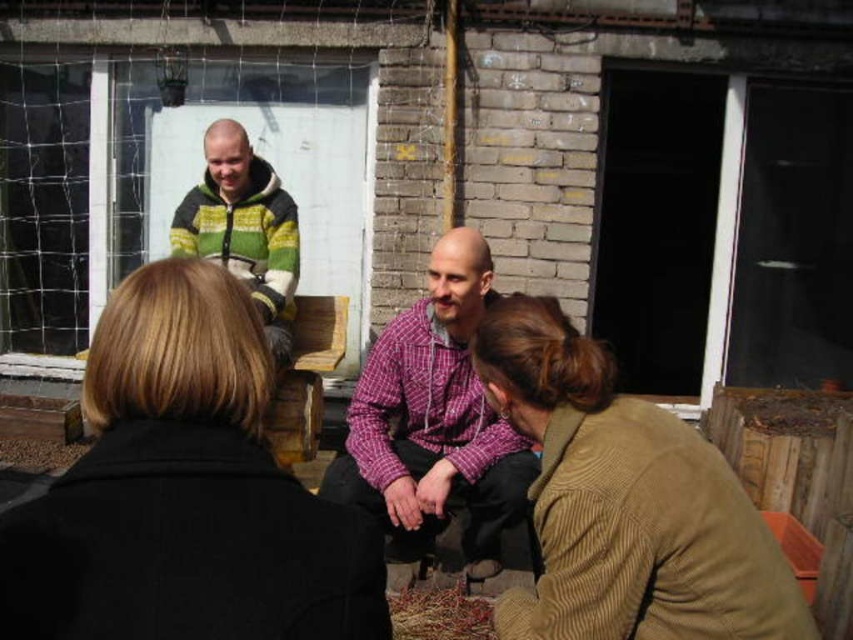
Question: Considering the relative positions of black wool coat at center and knitted wool sweater at upper left in the image provided, where is black wool coat at center located with respect to knitted wool sweater at upper left?

Choices:
 (A) above
 (B) below

Answer: (B)

Question: Is brown corduroy jacket at lower right to the right of knitted wool sweater at upper left from the viewer's perspective?

Choices:
 (A) yes
 (B) no

Answer: (A)

Question: Estimate the real-world distances between objects in this image. Which object is closer to the brown corduroy jacket at lower right?

Choices:
 (A) black wool coat at center
 (B) knitted wool sweater at upper left

Answer: (A)

Question: Is black wool coat at center further to camera compared to brown corduroy jacket at lower right?

Choices:
 (A) no
 (B) yes

Answer: (A)

Question: Which object appears closest to the camera in this image?

Choices:
 (A) black wool coat at center
 (B) knitted wool sweater at upper left
 (C) brown corduroy jacket at lower right
 (D) purple checkered shirt at center

Answer: (A)

Question: Among these points, which one is farthest from the camera?

Choices:
 (A) pyautogui.click(x=352, y=422)
 (B) pyautogui.click(x=294, y=227)
 (C) pyautogui.click(x=79, y=483)
 (D) pyautogui.click(x=589, y=618)

Answer: (B)